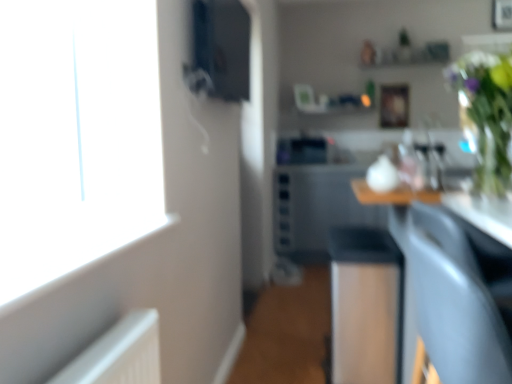
Question: Is black glossy sink at center situated inside wooden picture frame at upper center or outside?

Choices:
 (A) outside
 (B) inside

Answer: (A)

Question: Is black glossy sink at center taller or shorter than wooden picture frame at upper center?

Choices:
 (A) tall
 (B) short

Answer: (B)

Question: Estimate the real-world distances between objects in this image. Which object is closer to the green glass vase at upper right?

Choices:
 (A) matte black speaker at upper center
 (B) black glossy sink at center
 (C) black glossy dishwasher at center
 (D) wooden picture frame at upper center
 (E) matte gray armchair at lower right

Answer: (C)

Question: Which object is positioned closest to the matte gray armchair at lower right?

Choices:
 (A) wooden picture frame at upper center
 (B) matte black speaker at upper center
 (C) green glass vase at upper right
 (D) black glossy sink at center
 (E) black glossy dishwasher at center

Answer: (C)